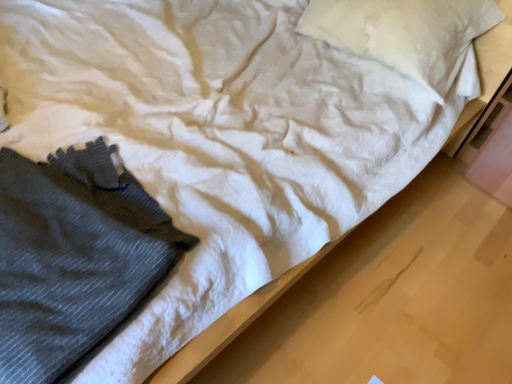
Describe the element at coordinates (74, 257) in the screenshot. The height and width of the screenshot is (384, 512). I see `dark gray knitted sweater at lower left` at that location.

What is the approximate width of dark gray knitted sweater at lower left?

20.03 inches.

Locate an element on the screen. dark gray knitted sweater at lower left is located at coordinates coord(74,257).

You are a GUI agent. You are given a task and a screenshot of the screen. Output one action in this format:
    pyautogui.click(x=<x>, y=<y>)
    Task: Click on the white cotton pillow at upper center
    
    Given the screenshot: What is the action you would take?
    pyautogui.click(x=404, y=33)

What do you see at coordinates (404, 33) in the screenshot?
I see `white cotton pillow at upper center` at bounding box center [404, 33].

Identify the location of dark gray knitted sweater at lower left. (74, 257).

Consider the image. Which is more to the left, dark gray knitted sweater at lower left or white cotton pillow at upper center?

dark gray knitted sweater at lower left is more to the left.

Which is in front, dark gray knitted sweater at lower left or white cotton pillow at upper center?

dark gray knitted sweater at lower left is more forward.

Between point (82, 223) and point (456, 51), which one is positioned in front?

The point (82, 223) is closer.

From the image's perspective, who appears lower, dark gray knitted sweater at lower left or white cotton pillow at upper center?

dark gray knitted sweater at lower left appears lower in the image.

From a real-world perspective, which is physically below, dark gray knitted sweater at lower left or white cotton pillow at upper center?

dark gray knitted sweater at lower left, from a real-world perspective.

Between dark gray knitted sweater at lower left and white cotton pillow at upper center, which one has smaller width?

dark gray knitted sweater at lower left is thinner.

Does dark gray knitted sweater at lower left have a lesser height compared to white cotton pillow at upper center?

Correct, dark gray knitted sweater at lower left is not as tall as white cotton pillow at upper center.

Is dark gray knitted sweater at lower left bigger than white cotton pillow at upper center?

No, dark gray knitted sweater at lower left is not bigger than white cotton pillow at upper center.

Is dark gray knitted sweater at lower left not within white cotton pillow at upper center?

Yes.

In the scene shown: Is dark gray knitted sweater at lower left next to white cotton pillow at upper center and touching it?

No, dark gray knitted sweater at lower left is not making contact with white cotton pillow at upper center.

Is dark gray knitted sweater at lower left oriented away from white cotton pillow at upper center?

No, dark gray knitted sweater at lower left's orientation is not away from white cotton pillow at upper center.

What's the angular difference between dark gray knitted sweater at lower left and white cotton pillow at upper center's facing directions?

The angle between the facing direction of dark gray knitted sweater at lower left and the facing direction of white cotton pillow at upper center is 175 degrees.

At what (x,y) coordinates should I click in order to perform the action: click on pillow that is on the right side of dark gray knitted sweater at lower left. Please return your answer as a coordinate pair (x, y). Looking at the image, I should click on pos(404,33).

Which is more to the right, white cotton pillow at upper center or dark gray knitted sweater at lower left?

white cotton pillow at upper center.

Which object is further away from the camera, white cotton pillow at upper center or dark gray knitted sweater at lower left?

white cotton pillow at upper center.

Does point (317, 31) lie behind point (5, 376)?

Yes, it is behind point (5, 376).

From the image's perspective, which one is positioned lower, white cotton pillow at upper center or dark gray knitted sweater at lower left?

dark gray knitted sweater at lower left appears lower in the image.

From a real-world perspective, is white cotton pillow at upper center physically located above or below dark gray knitted sweater at lower left?

Clearly, from a real-world perspective, white cotton pillow at upper center is above dark gray knitted sweater at lower left.

Can you confirm if white cotton pillow at upper center is wider than dark gray knitted sweater at lower left?

Yes, white cotton pillow at upper center is wider than dark gray knitted sweater at lower left.

Who is taller, white cotton pillow at upper center or dark gray knitted sweater at lower left?

white cotton pillow at upper center.

Can you confirm if white cotton pillow at upper center is bigger than dark gray knitted sweater at lower left?

Indeed, white cotton pillow at upper center has a larger size compared to dark gray knitted sweater at lower left.

From the picture: Is white cotton pillow at upper center located outside dark gray knitted sweater at lower left?

white cotton pillow at upper center is positioned outside dark gray knitted sweater at lower left.

Is white cotton pillow at upper center far away from dark gray knitted sweater at lower left?

Absolutely, white cotton pillow at upper center is distant from dark gray knitted sweater at lower left.

Is white cotton pillow at upper center facing away from dark gray knitted sweater at lower left?

No.

In the scene shown: Can you tell me how much white cotton pillow at upper center and dark gray knitted sweater at lower left differ in facing direction?

175 degrees.

Based on the photo, measure the distance between white cotton pillow at upper center and dark gray knitted sweater at lower left.

They are 3.74 feet apart.

Find the location of a particular element. The width and height of the screenshot is (512, 384). pillow above the dark gray knitted sweater at lower left (from a real-world perspective) is located at coordinates point(404,33).

Where is `pillow above the dark gray knitted sweater at lower left (from the image's perspective)`? pillow above the dark gray knitted sweater at lower left (from the image's perspective) is located at coordinates (404, 33).

The image size is (512, 384). What are the coordinates of `clothing below the white cotton pillow at upper center (from a real-world perspective)` in the screenshot? It's located at (74, 257).